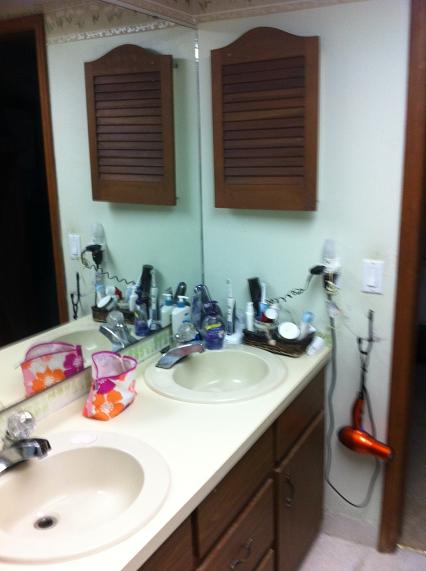
Locate an element on the screen. The width and height of the screenshot is (426, 571). bathroom full wall mirror is located at coordinates (51, 191).